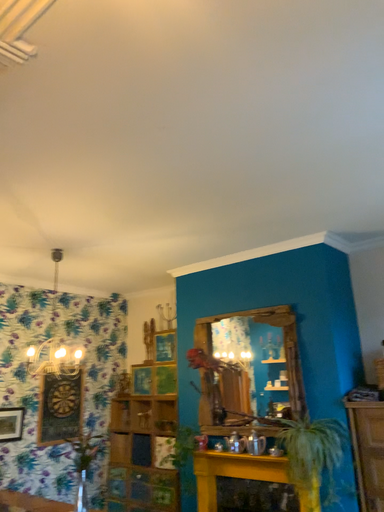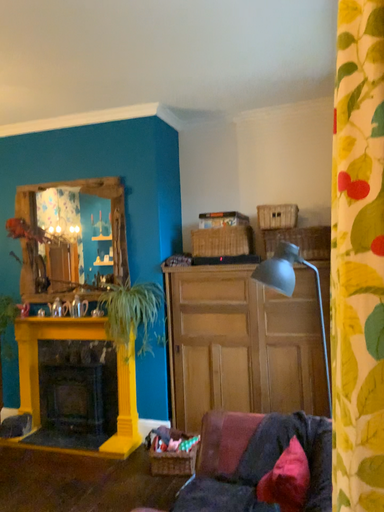
Question: Which way did the camera rotate in the video?

Choices:
 (A) rotated upward
 (B) rotated downward

Answer: (B)